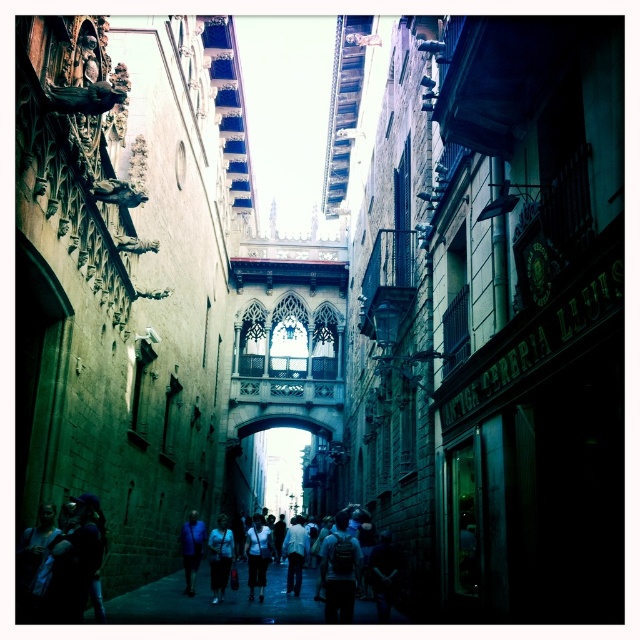
You are a tour guide leading a group through this historic street. You notice two tourists wearing a matte white shirt at center and a blue fabric shirt at center. Which tourist is standing to the right of the other?

The matte white shirt at center is positioned on the right side of the blue fabric shirt at center, so the tourist wearing the matte white shirt at center is standing to the right of the one in the blue fabric shirt at center.

Based on the photo, you are a tourist standing in the narrow historic street. You want to take a photo of the ornate carvings on the left building. You are currently holding a camera. Is the white cotton shirt at center in your way?

The white cotton shirt at center and camera are 74.76 meters apart from each other, so the white cotton shirt at center is too far away to block your view. You can take the photo without any obstruction.